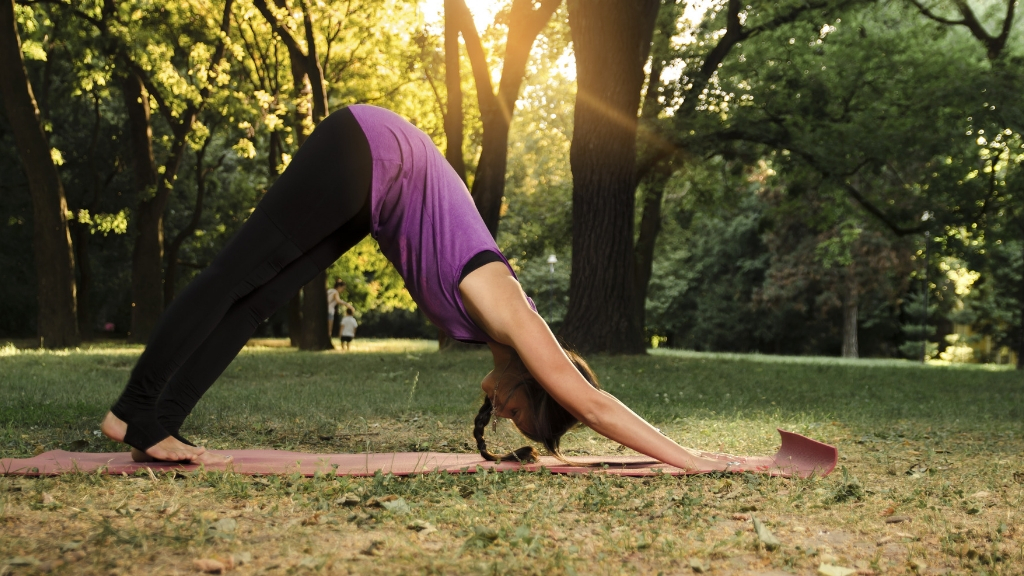
Where is `yoga mat`? yoga mat is located at coordinates (801, 458), (282, 469).